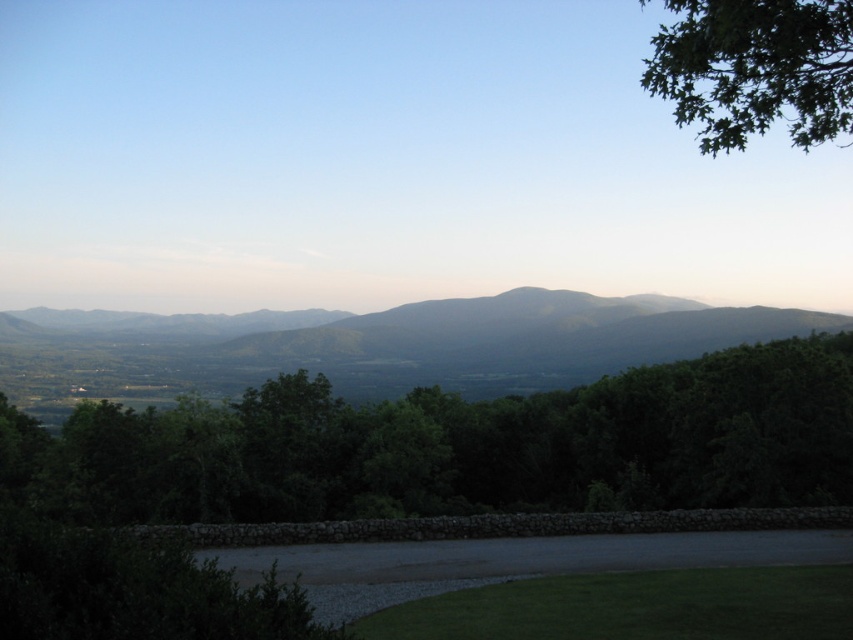
Question: Can you confirm if green leafy tree at center is positioned to the left of green leafy tree at upper right?

Choices:
 (A) no
 (B) yes

Answer: (B)

Question: Which object is the farthest from the green leafy tree at upper right?

Choices:
 (A) green textured mountain at center
 (B) green leafy tree at center

Answer: (A)

Question: In this image, where is green leafy tree at center located relative to green leafy tree at upper right?

Choices:
 (A) above
 (B) below

Answer: (B)

Question: Is green leafy tree at center closer to the viewer compared to green leafy tree at upper right?

Choices:
 (A) no
 (B) yes

Answer: (A)

Question: Which of these objects is positioned closest to the green textured mountain at center?

Choices:
 (A) green leafy tree at upper right
 (B) green leafy tree at center

Answer: (A)

Question: Which point appears farthest from the camera in this image?

Choices:
 (A) (503, 305)
 (B) (242, 492)

Answer: (A)